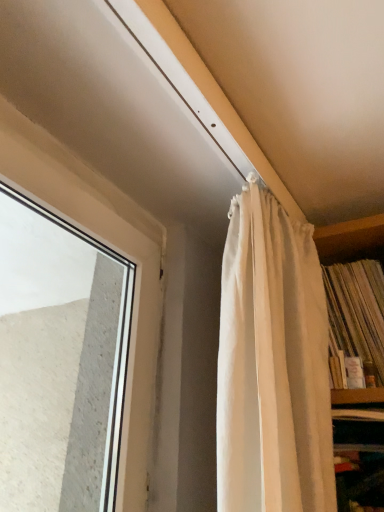
Describe the element at coordinates (357, 311) in the screenshot. I see `white paper book at right` at that location.

Measure the distance between point (337,270) and camera.

Point (337,270) and camera are 1.05 meters apart.

Where is `white paper book at right`? This screenshot has height=512, width=384. white paper book at right is located at coordinates (357, 311).

The width and height of the screenshot is (384, 512). I want to click on white paper book at right, so click(357, 311).